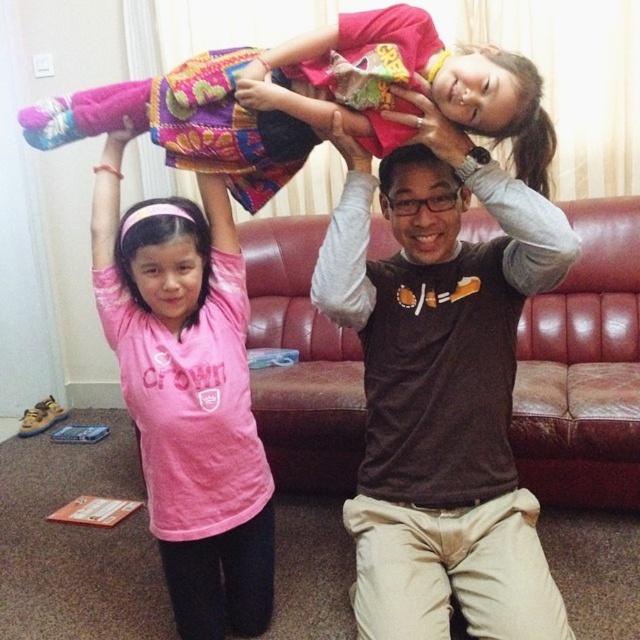
Where is the pink matte shirt at center located in the image?

The pink matte shirt at center is located at point coordinates of 0.619 on the x axis and 0.295 on the y axis.